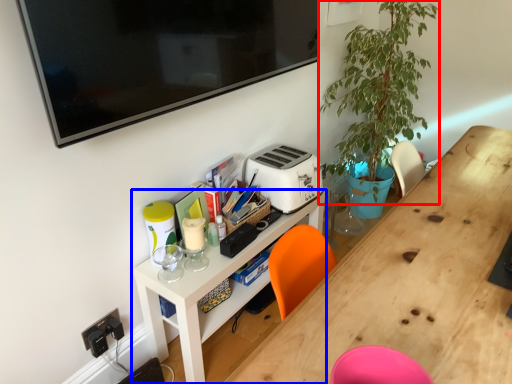
Question: Which object is closer to the camera taking this photo, plant (highlighted by a red box) or shelf (highlighted by a blue box)?

Choices:
 (A) plant
 (B) shelf

Answer: (B)